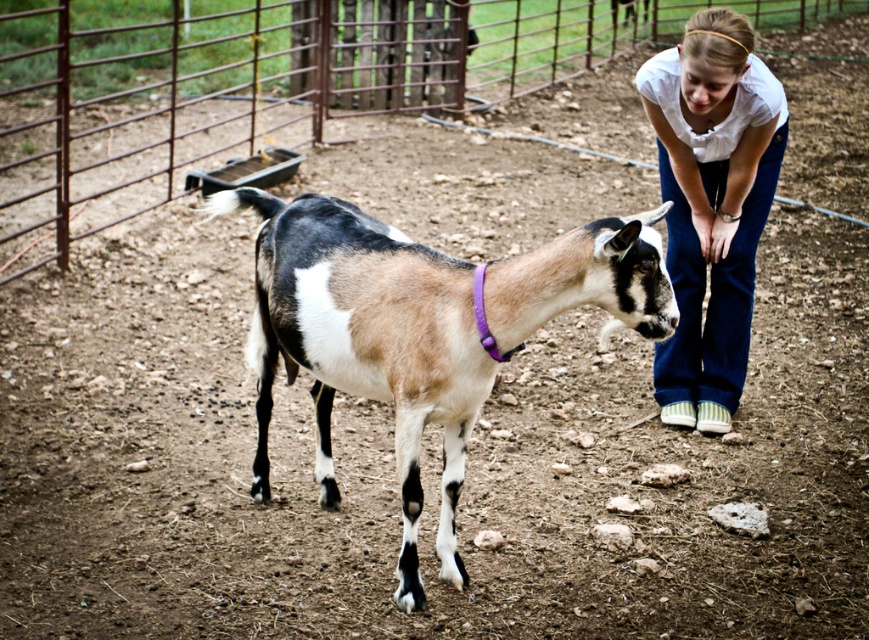
Question: Is brushed metal fence at center below white cotton shirt at center?

Choices:
 (A) yes
 (B) no

Answer: (B)

Question: Which object is the farthest from the brushed metal fence at center?

Choices:
 (A) spotted fur goat at center
 (B) white cotton shirt at center

Answer: (B)

Question: Which of the following is the closest to the observer?

Choices:
 (A) brushed metal fence at center
 (B) spotted fur goat at center

Answer: (B)

Question: Which point appears closest to the camera in this image?

Choices:
 (A) (313, 300)
 (B) (672, 177)
 (C) (113, 216)

Answer: (A)

Question: Observing the image, what is the correct spatial positioning of brushed metal fence at center in reference to spotted fur goat at center?

Choices:
 (A) left
 (B) right

Answer: (A)

Question: Is brushed metal fence at center below spotted fur goat at center?

Choices:
 (A) yes
 (B) no

Answer: (B)